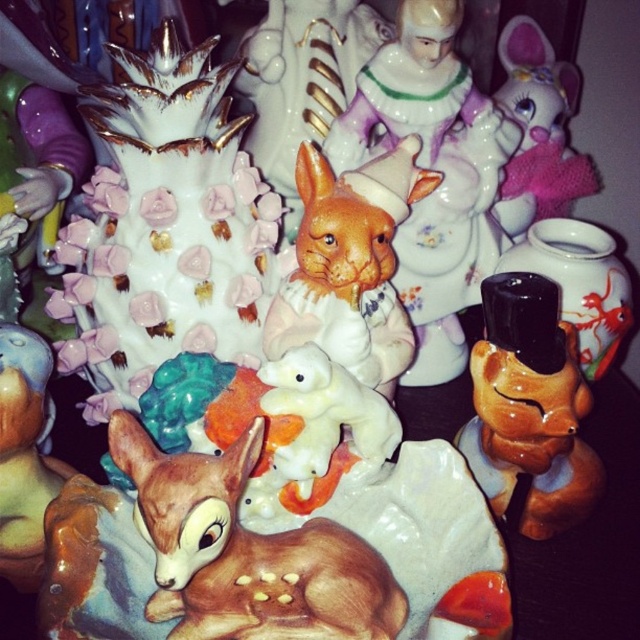
What are the coordinates of the pink fabric bunny at upper right?

The pink fabric bunny at upper right is located at coordinates point (x=538, y=129).

You are arranging a display and need to place a new item between the pink fabric bunny at upper right and the matte ceramic deer at lower left. Based on their positions, which side of the deer should you place the new item to ensure it is between them?

The pink fabric bunny at upper right is to the right of the matte ceramic deer at lower left, so placing the new item to the right side of the matte ceramic deer at lower left will position it between them.